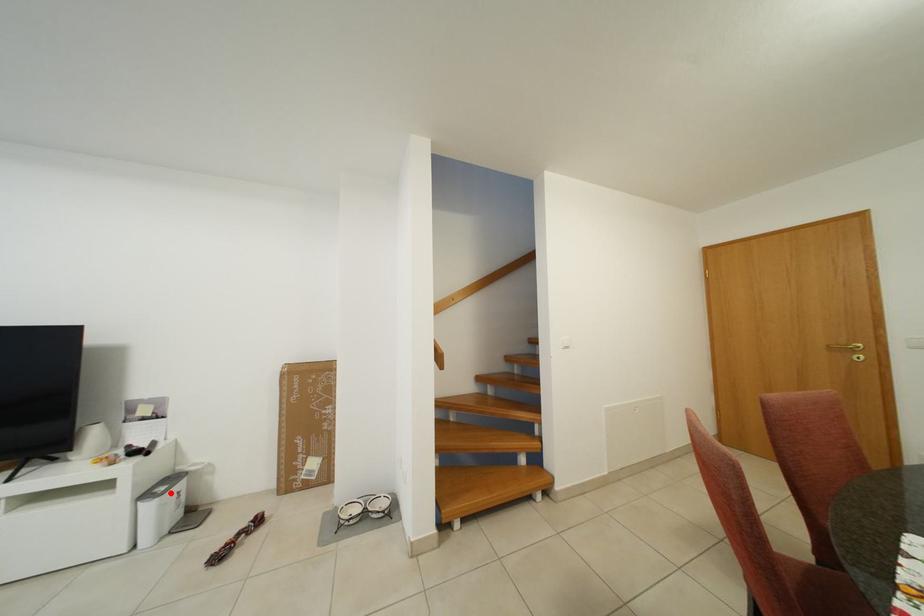
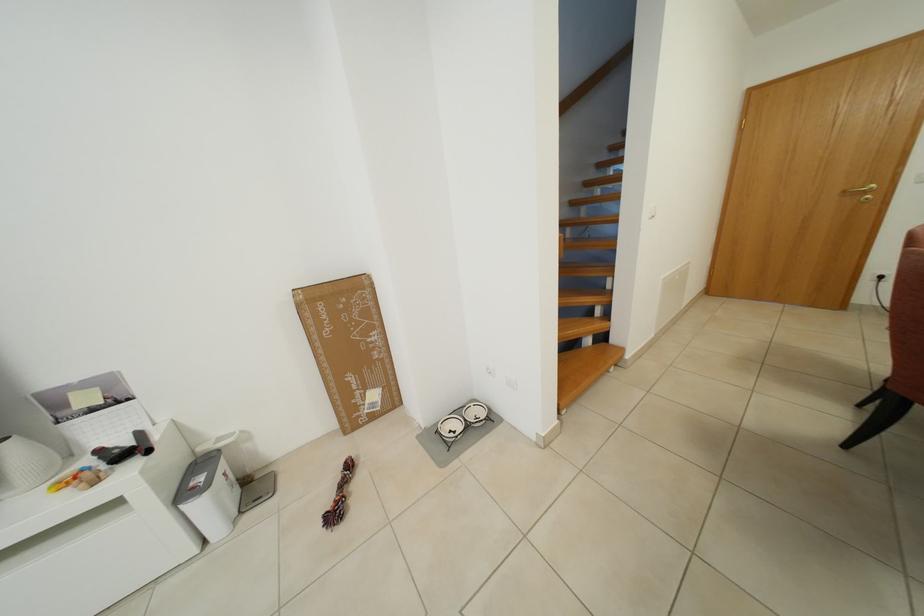
In the second image, find the point that corresponds to the highlighted location in the first image.

(208, 484)